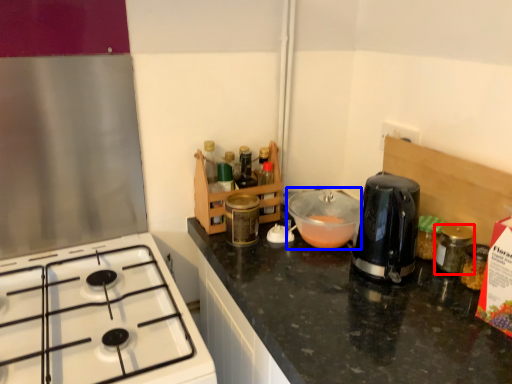
Question: Among these objects, which one is nearest to the camera, bottle (highlighted by a red box) or bowl (highlighted by a blue box)?

Choices:
 (A) bottle
 (B) bowl

Answer: (A)